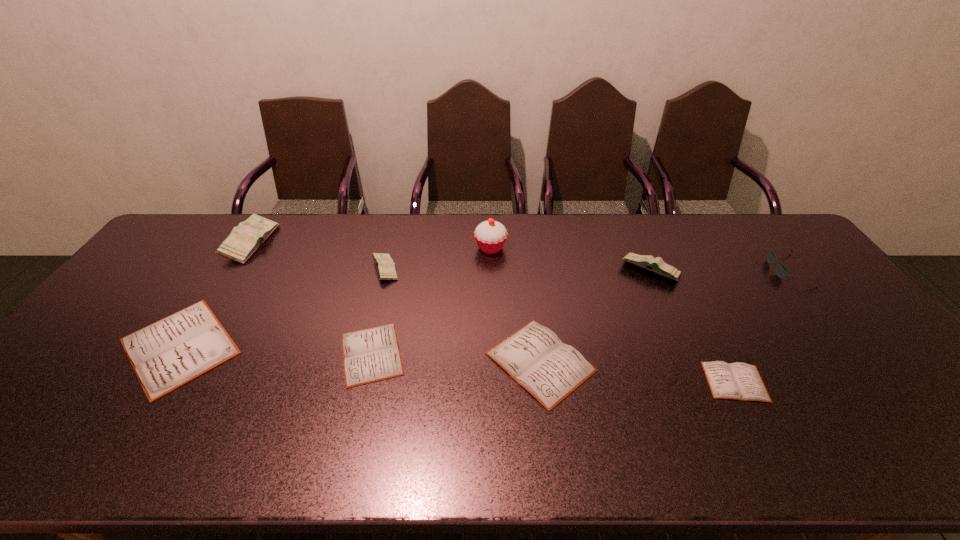
Identify the location of the sixth tallest object. (173, 351).

Locate an element on the screen. This screenshot has height=540, width=960. the fourth tallest diary is located at coordinates (173, 351).

Identify the location of the third diary from right to left. (534, 356).

Identify the location of the third shortest diary. The image size is (960, 540). (534, 356).

Image resolution: width=960 pixels, height=540 pixels. I want to click on the second smallest white diary, so click(373, 354).

This screenshot has height=540, width=960. Identify the location of the eighth tallest object. (373, 354).

I want to click on the shortest object, so click(740, 381).

At what (x,y) coordinates should I click in order to perform the action: click on the shortest diary. Please return your answer as a coordinate pair (x, y). This screenshot has width=960, height=540. Looking at the image, I should click on (740, 381).

At what (x,y) coordinates should I click in order to perform the action: click on free spot located 0.170m on the front of the cupcake. Please return your answer as a coordinate pair (x, y). Looking at the image, I should click on (492, 295).

Image resolution: width=960 pixels, height=540 pixels. In order to click on blank area located 0.340m on the right of the biggest pink diary in this screenshot , I will do `click(371, 242)`.